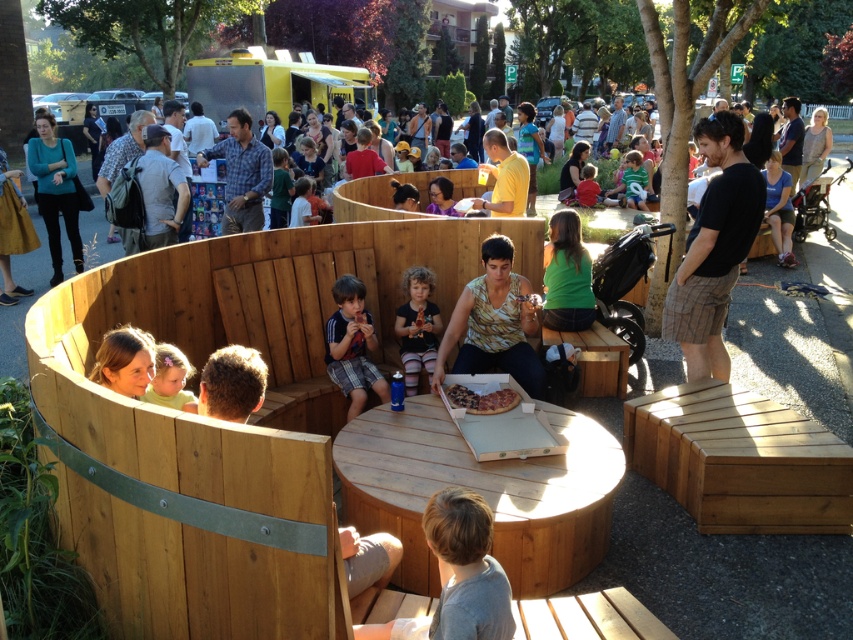
In the park scene, there are people sitting on wooden benches arranged in a semi circle and a round table with a pizza box and blue water bottle at the center. A person wearing a striped t shirt is located at point [352,346]. If you were standing at the center of the round table, would the striped t shirt at center be directly in front of you or to your side?

The striped t shirt at center is located at point [352,346], which is directly in front of you if you are standing at the center of the round table.